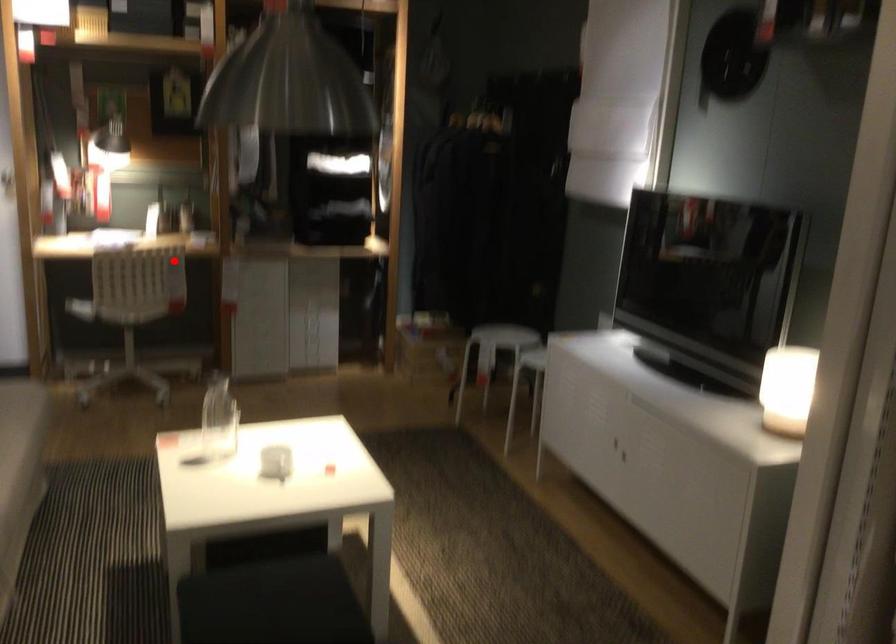
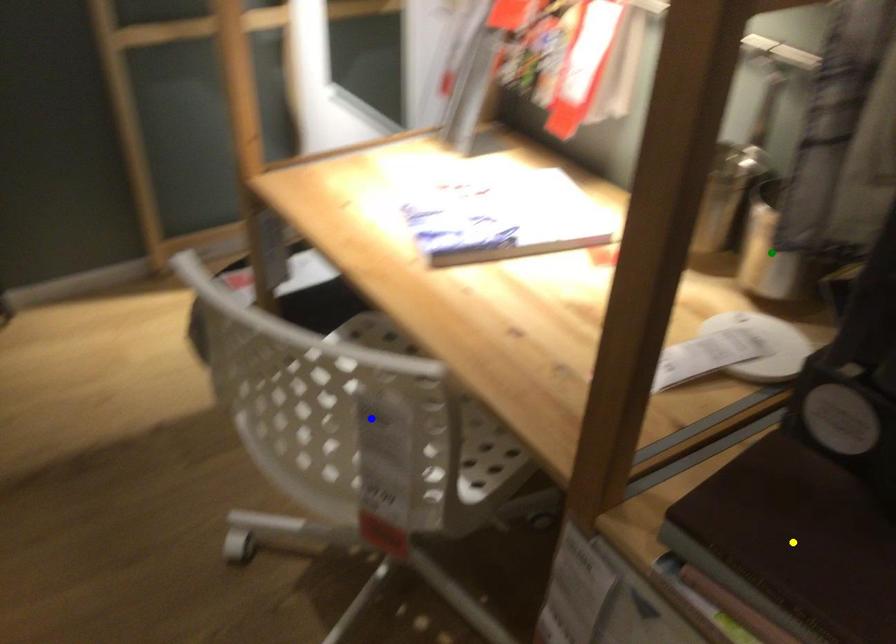
Question: I am providing you with two images of the same scene from different viewpoints. A red point is marked on the first image. You are given multiple points on the second image. Which point in image 2 represents the same 3d spot as the red point in image 1?

Choices:
 (A) yellow point
 (B) blue point
 (C) green point

Answer: (B)